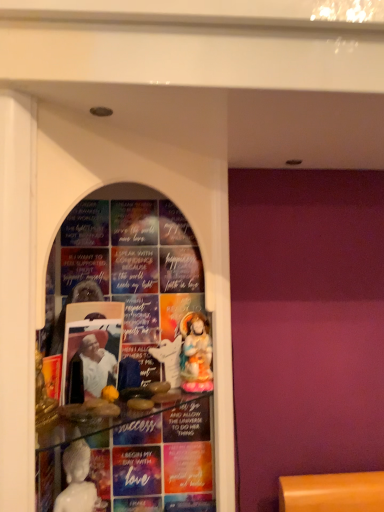
Question: From the image's perspective, is white glossy statue at center, the second person in the right-to-left sequence, above or below transparent glass shelf at center?

Choices:
 (A) below
 (B) above

Answer: (A)

Question: From a real-world perspective, is white glossy statue at center, the first person in the front-to-back sequence, positioned above or below transparent glass shelf at center?

Choices:
 (A) below
 (B) above

Answer: (A)

Question: Which object is the closest to the transparent glass shelf at center?

Choices:
 (A) white glossy statue at center
 (B) white glossy statue at center, the first person in the front-to-back sequence
 (C) porcelain statue at center, placed as the 1th person when sorted from right to left

Answer: (B)

Question: Which object is the closest to the porcelain statue at center, which appears as the 1th person when viewed from the back?

Choices:
 (A) white glossy statue at center
 (B) transparent glass shelf at center
 (C) white glossy statue at center, the first person viewed from the left

Answer: (A)